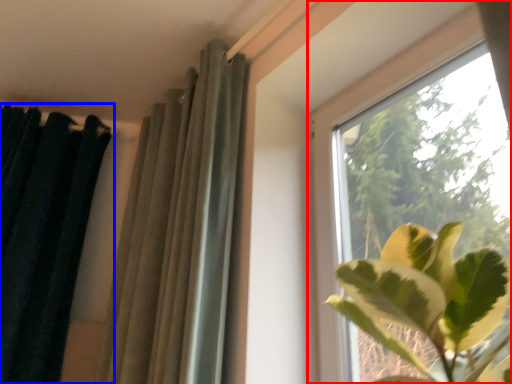
Question: Which point is further to the camera, window (highlighted by a red box) or curtain (highlighted by a blue box)?

Choices:
 (A) window
 (B) curtain

Answer: (B)